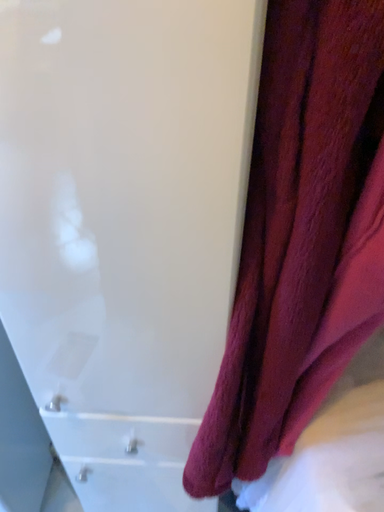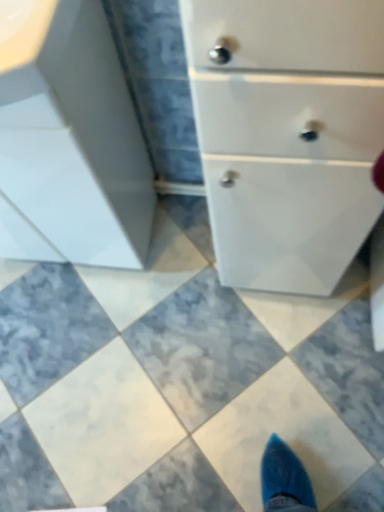
Question: How did the camera likely rotate when shooting the video?

Choices:
 (A) rotated upward
 (B) rotated downward

Answer: (B)